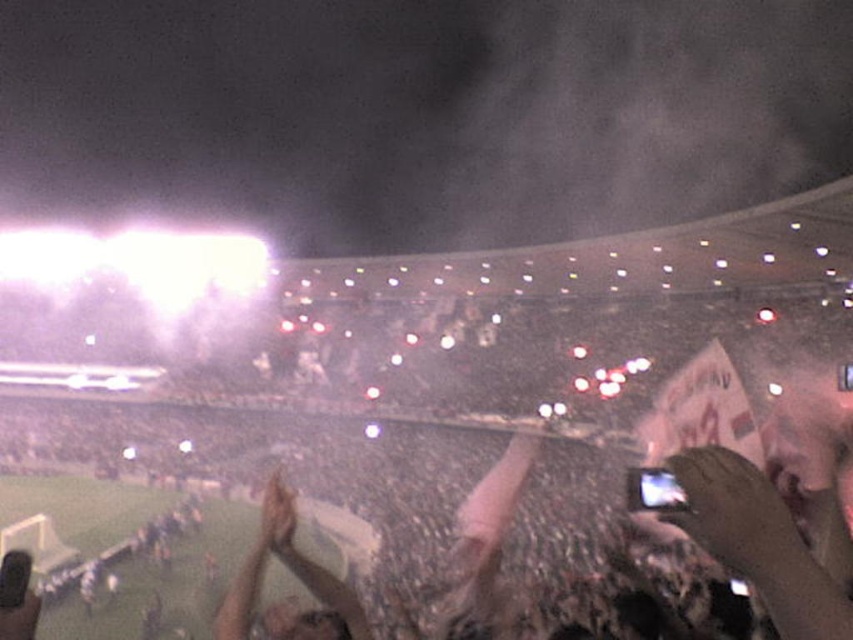
Is light brown leather jacket at center below smooth skin hand at center?

Correct, light brown leather jacket at center is located below smooth skin hand at center.

Can you confirm if light brown leather jacket at center is thinner than smooth skin hand at center?

In fact, light brown leather jacket at center might be wider than smooth skin hand at center.

Identify the location of light brown leather jacket at center. The height and width of the screenshot is (640, 853). (297, 579).

Can you confirm if smooth brown leather hand at center is positioned to the left of smooth skin hand at center?

Incorrect, smooth brown leather hand at center is not on the left side of smooth skin hand at center.

How much distance is there between smooth brown leather hand at center and smooth skin hand at center?

They are 11.63 meters apart.

Is point (682, 486) in front of point (276, 490)?

Yes, it is in front of point (276, 490).

Find the location of `smooth brown leather hand at center`. smooth brown leather hand at center is located at coordinates (735, 515).

Is point (776, 611) more distant than point (337, 628)?

No, it is not.

Does point (668, 458) lie in front of point (253, 572)?

Yes, it is in front of point (253, 572).

At what (x,y) coordinates should I click in order to perform the action: click on smooth brown leather hand at center. Please return your answer as a coordinate pair (x, y). Image resolution: width=853 pixels, height=640 pixels. Looking at the image, I should click on (735, 515).